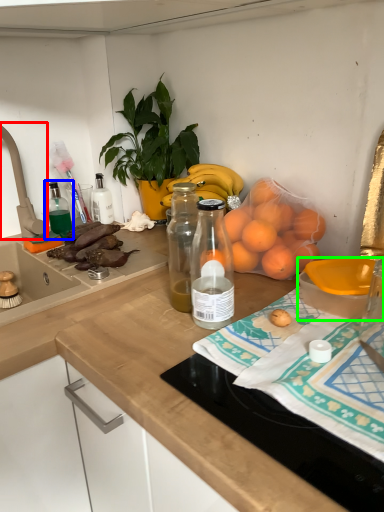
Question: Which is farther away from faucet (highlighted by a red box)? bottle (highlighted by a blue box) or bowl (highlighted by a green box)?

Choices:
 (A) bottle
 (B) bowl

Answer: (B)